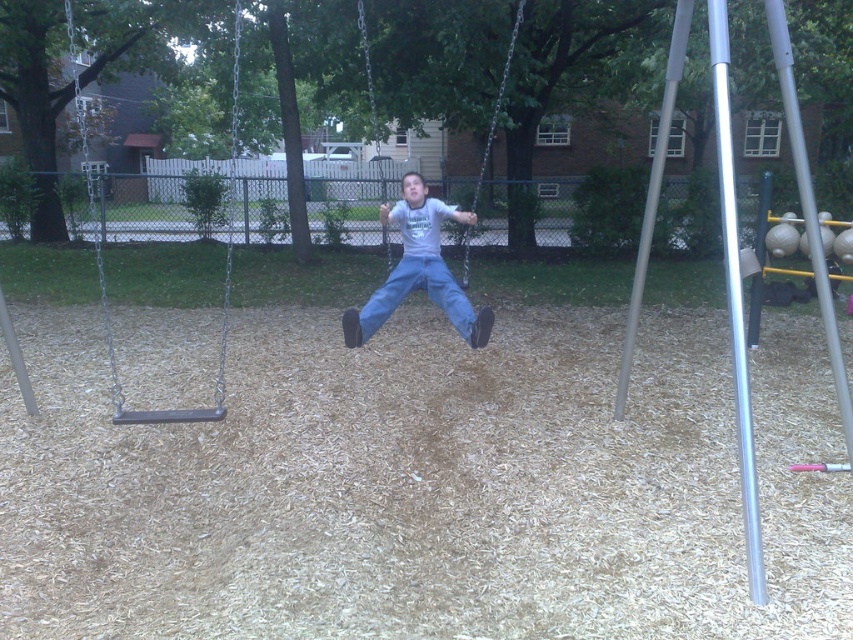
You are a parent trying to choose between two pairs of jeans for your child. You see the light blue jeans at center and the blue denim jeans at center in the playground. Which pair would be more appropriate for active play based on their size?

The light blue jeans at center are bigger than the blue denim jeans at center, so they would be more appropriate for active play as they allow more movement.